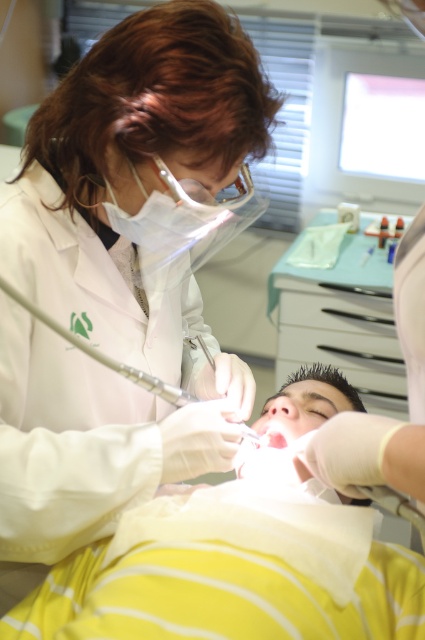
You are a dental assistant observing the procedure. The yellow striped fabric at lower center and the pink glossy lips at center are both in view. Which object takes up more space in the image?

The yellow striped fabric at lower center is larger in size than the pink glossy lips at center, so it takes up more space in the image.